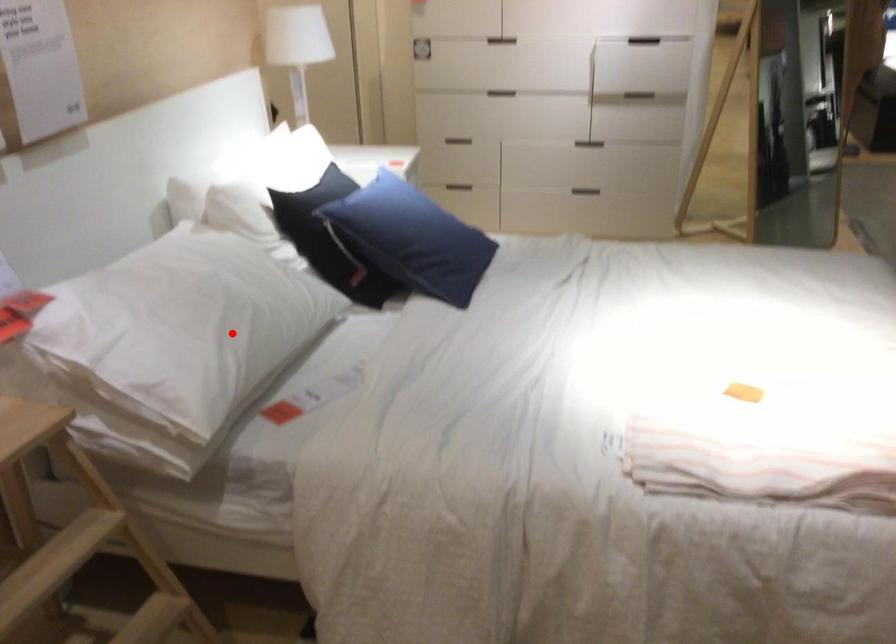
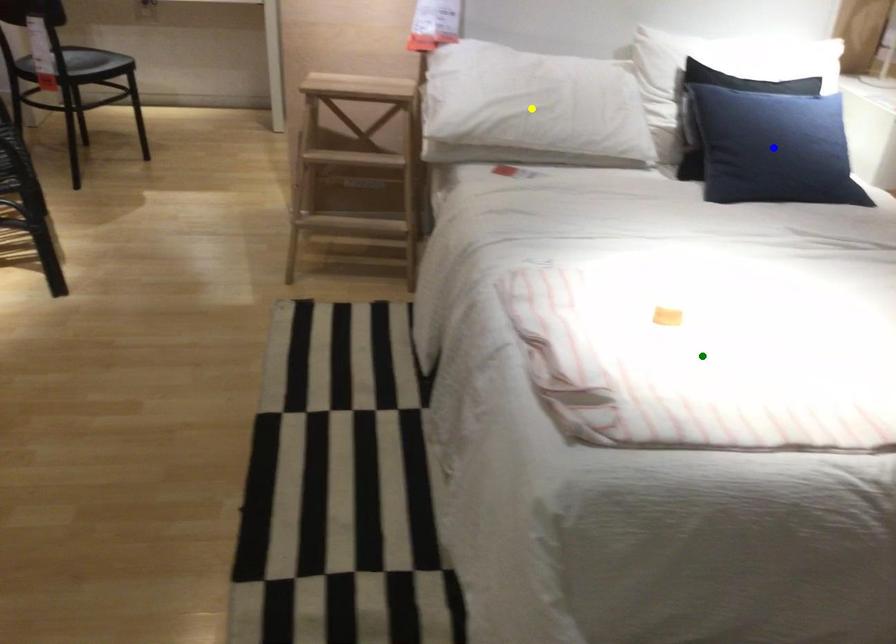
Question: I am providing you with two images of the same scene from different viewpoints. A red point is marked on the first image. You are given multiple points on the second image. Which mark in image 2 goes with the point in image 1?

Choices:
 (A) green point
 (B) blue point
 (C) yellow point

Answer: (C)